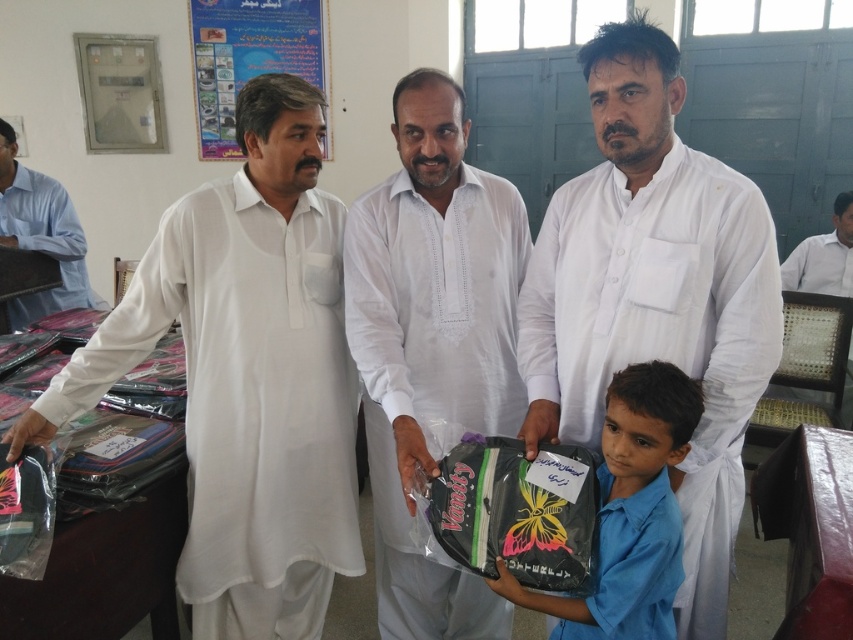
Between white cotton shirt at left and white cotton shirt at center, which one appears on the left side from the viewer's perspective?

Positioned to the left is white cotton shirt at left.

Is point (302, 632) closer to camera compared to point (448, 262)?

No, it is behind (448, 262).

Who is more distant from viewer, (x=326, y=291) or (x=445, y=612)?

The point (x=445, y=612) is more distant.

The width and height of the screenshot is (853, 640). Identify the location of white cotton shirt at left. (247, 376).

Which is above, white matte shirt at center or matte black backpack at center?

white matte shirt at center is higher up.

Is point (683, 300) positioned in front of point (641, 396)?

No, it is behind (641, 396).

Between point (544, 227) and point (650, 461), which one is positioned behind?

Positioned behind is point (544, 227).

This screenshot has width=853, height=640. I want to click on white matte shirt at center, so click(x=654, y=296).

Can you confirm if white cotton shirt at center is positioned below light blue shirt at left?

Yes, white cotton shirt at center is below light blue shirt at left.

Is the position of white cotton shirt at center more distant than that of light blue shirt at left?

No, white cotton shirt at center is in front of light blue shirt at left.

Does point (395, 385) come farther from viewer compared to point (61, 301)?

No, (395, 385) is closer to viewer.

Identify the location of white cotton shirt at center. (432, 340).